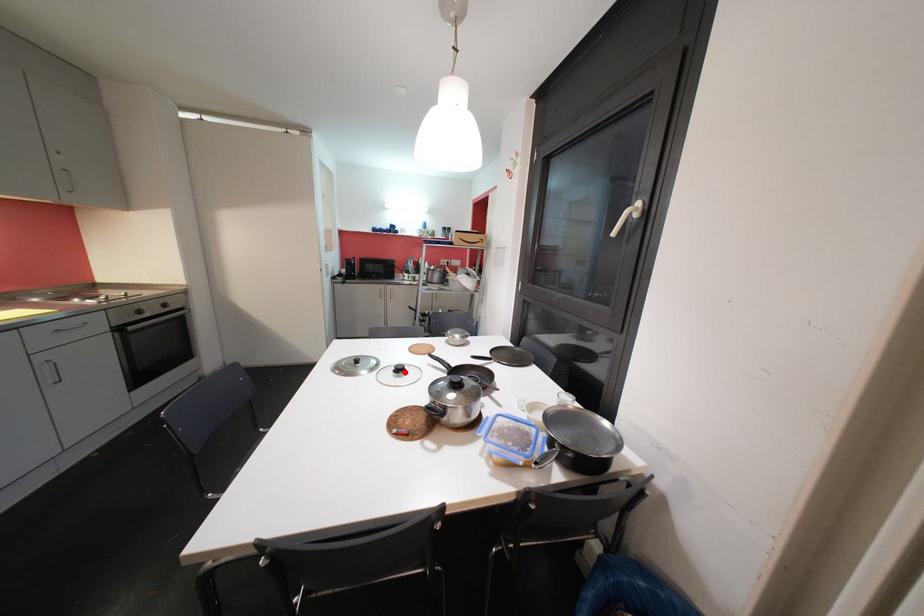
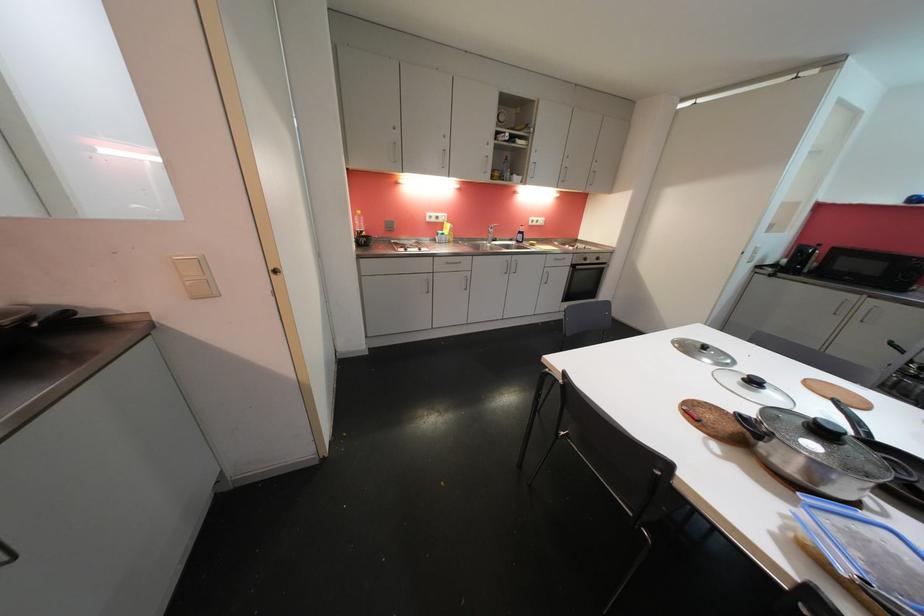
In the second image, find the point that corresponds to the highlighted location in the first image.

(759, 385)